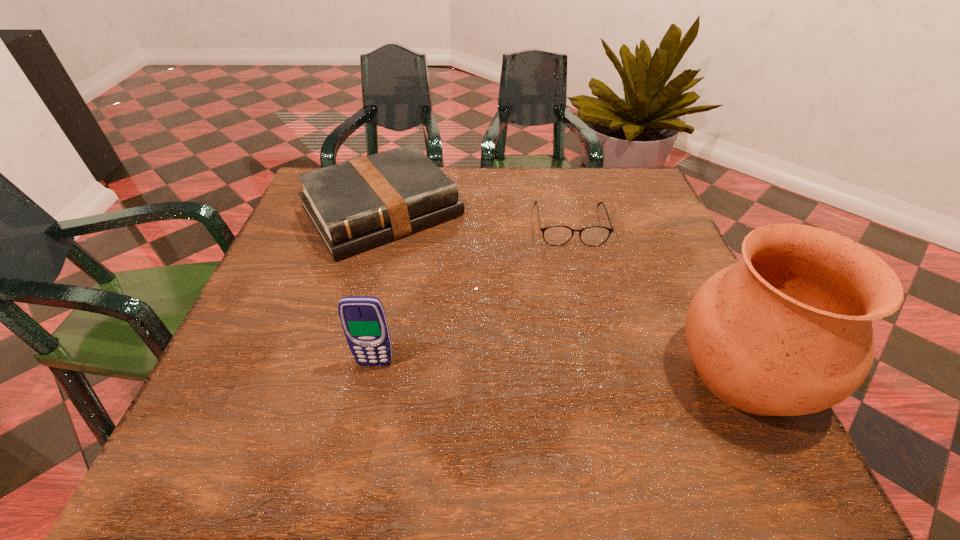
What are the coordinates of `vacant spot on the desktop that is between the third shortest object and the rightmost object and is positioned on the front-facing side of the spectacles` in the screenshot? It's located at (599, 369).

Where is `free space on the desktop that is between the cellular telephone and the pottery and is positioned on the spine side of the third tallest object`? The image size is (960, 540). free space on the desktop that is between the cellular telephone and the pottery and is positioned on the spine side of the third tallest object is located at coordinates (507, 367).